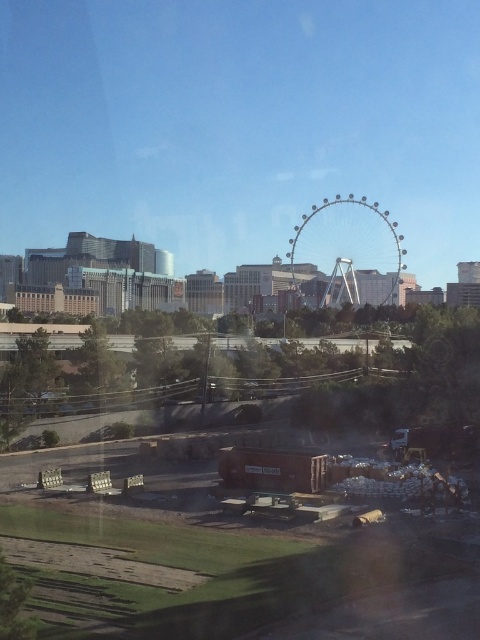
Where is `brown wooden pallets at lower left`? brown wooden pallets at lower left is located at coordinates (271, 518).

Measure the distance from brown wooden pallets at lower left to metallic silver ferris wheel at center.

A distance of 542.76 feet exists between brown wooden pallets at lower left and metallic silver ferris wheel at center.

Does point (309, 525) lie behind point (292, 260)?

No, (309, 525) is in front of (292, 260).

Find the location of a particular element. Image resolution: width=480 pixels, height=640 pixels. brown wooden pallets at lower left is located at coordinates (271, 518).